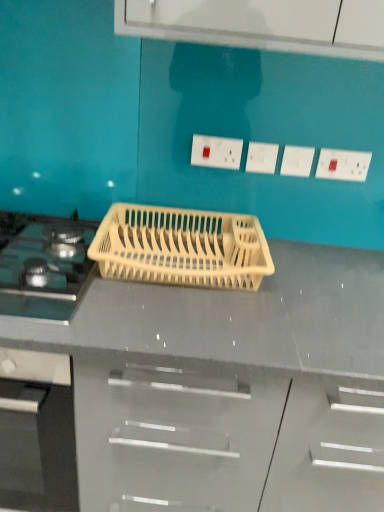
Question: From their relative heights in the image, would you say white plastic electric outlet at upper center, the second electric outlet from the right, is taller or shorter than white plastic electric outlet at center, arranged as the fourth electric outlet when viewed from the right?

Choices:
 (A) short
 (B) tall

Answer: (A)

Question: Is white plastic electric outlet at upper center, the second electric outlet from the right, in front of or behind white plastic electric outlet at center, arranged as the fourth electric outlet when viewed from the right, in the image?

Choices:
 (A) behind
 (B) front

Answer: (A)

Question: Which object is the closest to the white plastic electric outlet at upper center, the second electric outlet from the right?

Choices:
 (A) beige plastic dish rack at center
 (B) white plastic electric outlet at upper center, which is the second electric outlet from left to right
 (C) matte black gas stove at left
 (D) white plastic electric outlet at center, arranged as the fourth electric outlet when viewed from the right
 (E) white plastic electric outlet at upper right, positioned as the 4th electric outlet in left-to-right order

Answer: (B)

Question: Which object is the closest to the beige plastic dish rack at center?

Choices:
 (A) white plastic electric outlet at upper right, positioned as the 4th electric outlet in left-to-right order
 (B) white plastic electric outlet at upper center, the third electric outlet from the left
 (C) white plastic electric outlet at center, the first electric outlet from the left
 (D) matte black gas stove at left
 (E) white plastic electric outlet at upper center, which is the second electric outlet from left to right

Answer: (D)